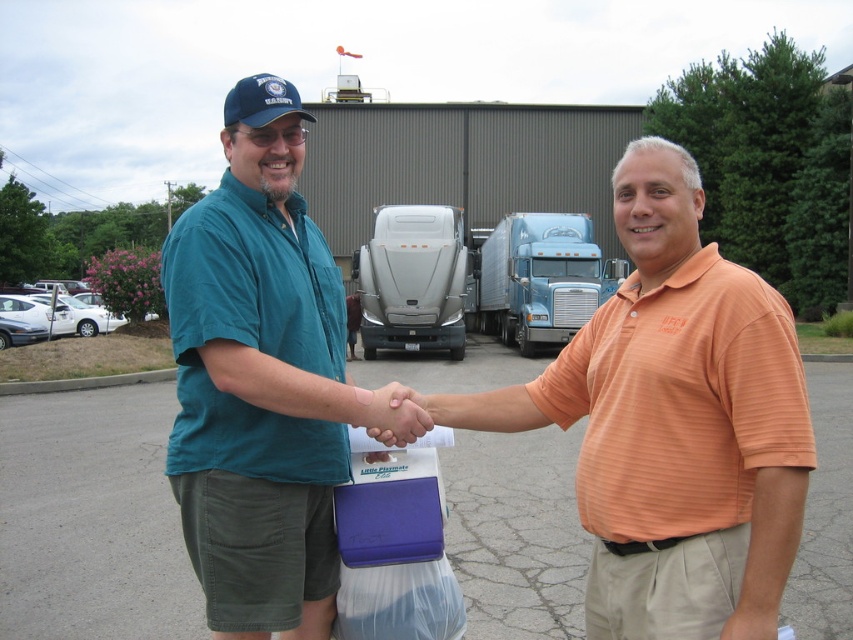
Question: Which object is the farthest from the teal shirt at center?

Choices:
 (A) blue metallic truck at center
 (B) satin silver semi-truck at center
 (C) orange striped polo shirt at center

Answer: (A)

Question: Does teal shirt at center come in front of satin silver semi-truck at center?

Choices:
 (A) no
 (B) yes

Answer: (B)

Question: Can you confirm if orange striped polo shirt at center is wider than satin silver semi-truck at center?

Choices:
 (A) yes
 (B) no

Answer: (B)

Question: Which point is farther to the camera?

Choices:
 (A) orange striped polo shirt at center
 (B) satin silver semi-truck at center
 (C) teal shirt at center
 (D) blue metallic truck at center

Answer: (D)

Question: Can you confirm if orange striped polo shirt at center is positioned above blue metallic truck at center?

Choices:
 (A) yes
 (B) no

Answer: (B)

Question: Which object is farther from the camera taking this photo?

Choices:
 (A) orange striped polo shirt at center
 (B) blue metallic truck at center
 (C) teal shirt at center

Answer: (B)